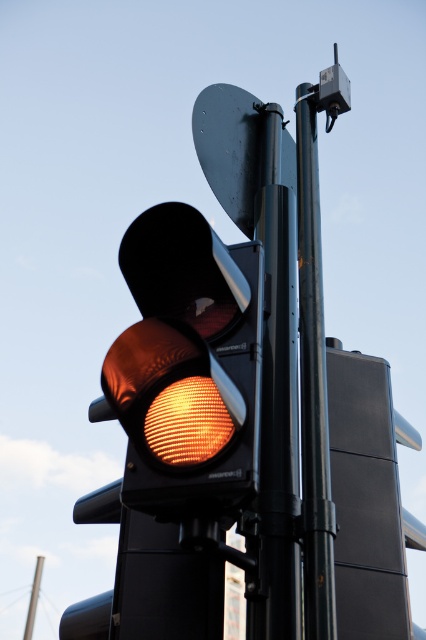
You are a city planner analyzing the placement of traffic lights. Given the coordinates of the matte orange glass traffic light at center, what is its exact position in the image?

The matte orange glass traffic light at center is located at the coordinates point [187,368].

You are a pedestrian standing at the crosswalk and see the black metallic pole at center and the orange led at center. Which object is located to the right of the other?

The black metallic pole at center is positioned on the right side of orange led at center, so the black metallic pole at center is to the right of the orange led at center.

Based on the photo, you are standing 2 meters away from the traffic light pole. A maintenance worker needs to reach a point at coordinate point (265, 540) on the pole to fix a sensor. If the worker can only safely reach up to 1.5 meters from their current position, will they be able to reach the point without a ladder?

The distance of point (265, 540) from viewer is 1.64 meters. Since the worker is standing 2 meters away from the pole and can only reach up to 1.5 meters from their current position, they cannot safely reach the point without a ladder because the required distance exceeds their reach limit.